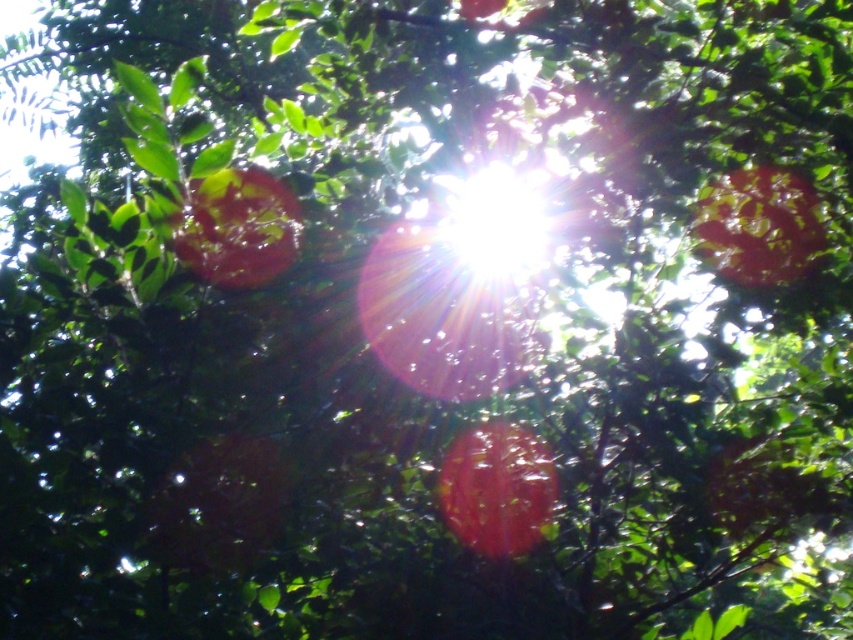
Question: Among these points, which one is nearest to the camera?

Choices:
 (A) (712, 193)
 (B) (520, 550)
 (C) (297, 211)

Answer: (B)

Question: Where is glossy red apple at center located in relation to glossy red apple at upper left in the image?

Choices:
 (A) below
 (B) above

Answer: (A)

Question: Among these objects, which one is nearest to the camera?

Choices:
 (A) glossy red apple at center
 (B) glossy red apple at upper left
 (C) glossy red apple at upper right

Answer: (B)

Question: Which of the following is the farthest from the observer?

Choices:
 (A) (502, 524)
 (B) (292, 256)

Answer: (A)

Question: Can you confirm if glossy red apple at upper right is smaller than glossy red apple at upper left?

Choices:
 (A) no
 (B) yes

Answer: (A)

Question: Where is glossy red apple at center located in relation to glossy red apple at upper left in the image?

Choices:
 (A) below
 (B) above

Answer: (A)